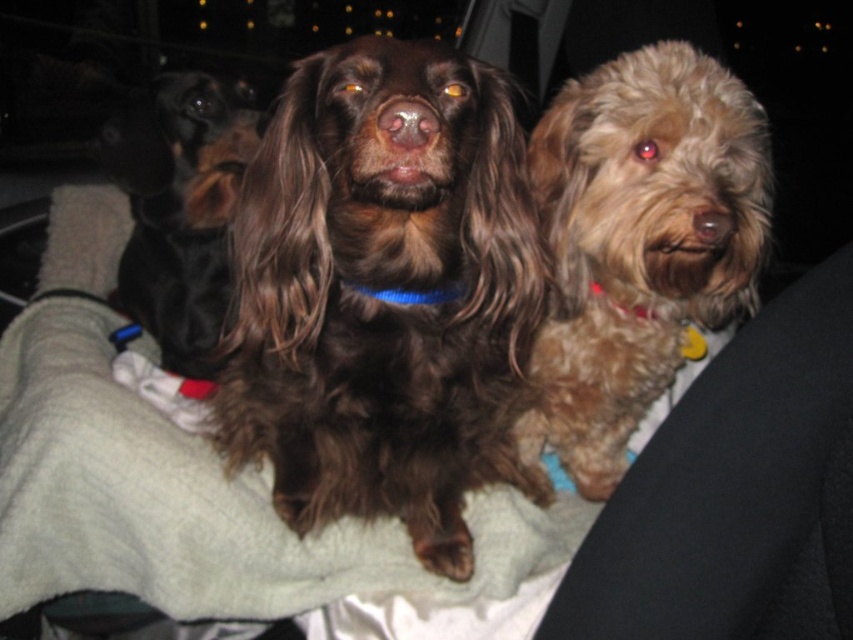
You are a photographer trying to capture a group photo of the brown furry dog at center and the fuzzy brown dog at center. The minimum distance required between the dogs for your camera to focus properly is 25 centimeters. Based on the scene, will the camera be able to focus on both dogs simultaneously?

The brown furry dog at center and fuzzy brown dog at center are 25.45 centimeters apart, which is just over the 25 centimeter requirement. Therefore, the camera should be able to focus on both dogs simultaneously.

You are standing in front of the three dogs sitting together. You want to place a treat exactly at the point marked by coordinates point [381,288]. Which dog will receive the treat?

The point [381,288] corresponds to the brown furry dog at center, so the treat will be placed on the brown furry dog at center.